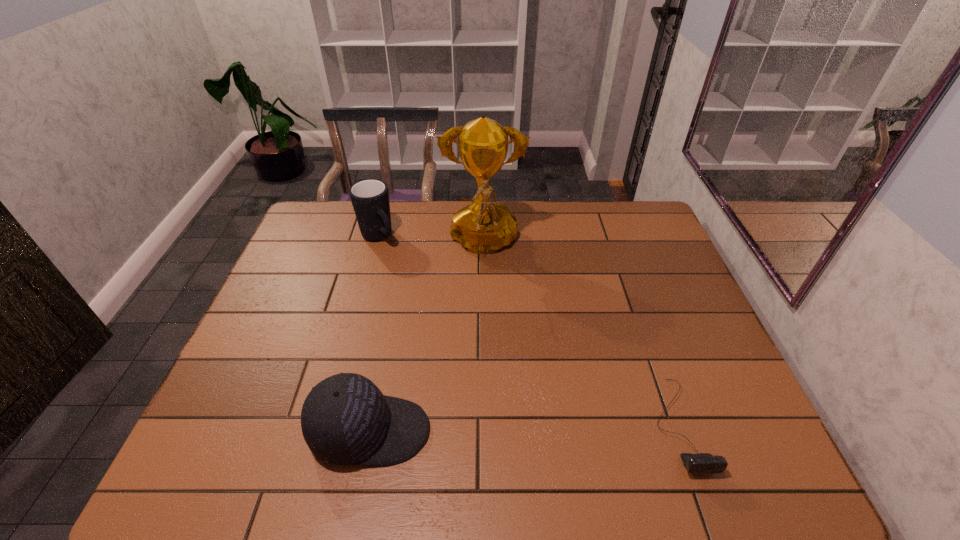
Locate an element on the screen. vacant space on the desktop that is between the third tallest object and the webcam and is positioned on the front side of the award is located at coordinates (482, 428).

This screenshot has height=540, width=960. In order to click on free space on the desktop that is between the baseball cap and the rightmost object and is positioned on the side of the mug with the handle in this screenshot , I will do `click(555, 427)`.